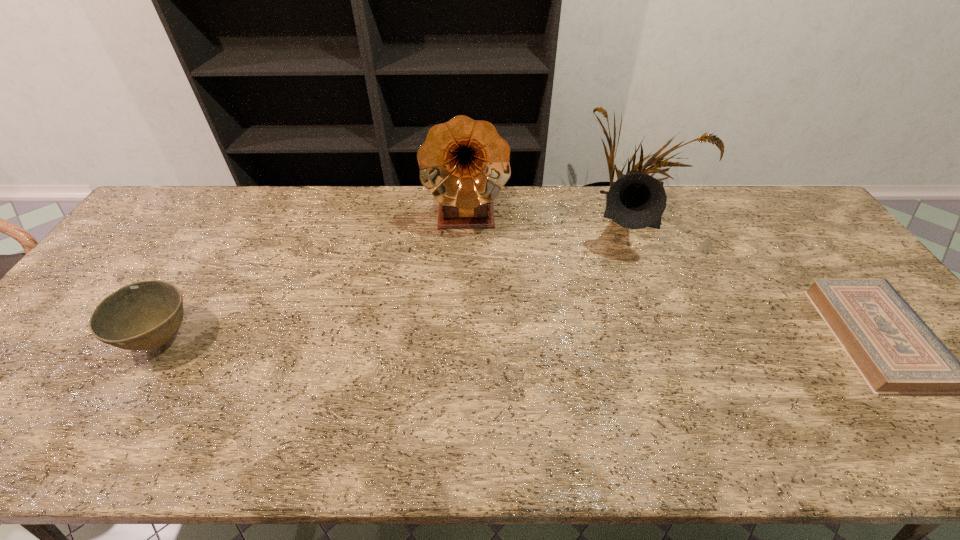
I want to click on free space between the third object from right to left and the second shortest object, so click(x=315, y=277).

This screenshot has height=540, width=960. Identify the location of vacant space in between the leftmost object and the third object from right to left. (315, 277).

At what (x,y) coordinates should I click in order to perform the action: click on vacant area that lies between the right phonograph_record and the left phonograph_record. Please return your answer as a coordinate pair (x, y). Looking at the image, I should click on (549, 219).

Where is `vacant region between the leftmost object and the right phonograph_record`? The width and height of the screenshot is (960, 540). vacant region between the leftmost object and the right phonograph_record is located at coordinates (396, 281).

Where is `object that can be found as the second closest to the leftmost object`? object that can be found as the second closest to the leftmost object is located at coordinates (635, 201).

Locate an element on the screen. This screenshot has height=540, width=960. object that is the closest one to the leftmost object is located at coordinates (464, 163).

This screenshot has height=540, width=960. I want to click on blank area in the image that satisfies the following two spatial constraints: 1. on the back side of the left phonograph_record; 2. on the left side of the leftmost object, so [x=237, y=215].